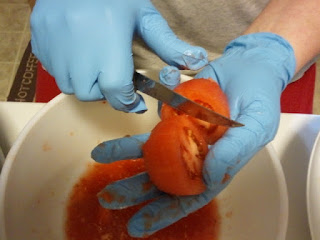
What are the coordinates of `floor` in the screenshot? It's located at (13, 35).